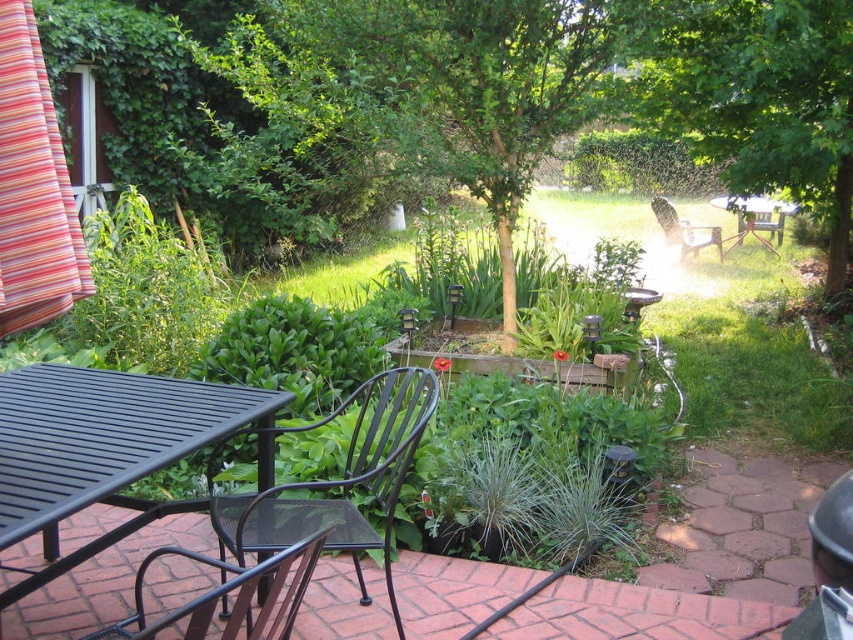
Based on the photo, is wooden chair at center smaller than wooden bench at center?

Actually, wooden chair at center might be larger than wooden bench at center.

How much distance is there between wooden chair at center and wooden bench at center?

wooden chair at center is 26.91 inches from wooden bench at center.

Find the location of `wooden chair at center`. wooden chair at center is located at coordinates (683, 228).

Between point (274, 637) and point (770, 241), which one is positioned behind?

The point (770, 241) is more distant.

Does black mesh chair at lower left have a larger size compared to wooden bench at center?

Indeed, black mesh chair at lower left has a larger size compared to wooden bench at center.

Is point (166, 621) farther from viewer compared to point (738, 227)?

No, (166, 621) is in front of (738, 227).

Where is `black mesh chair at lower left`? black mesh chair at lower left is located at coordinates click(x=228, y=593).

The image size is (853, 640). What are the coordinates of `black mesh chair at center` in the screenshot? It's located at (338, 480).